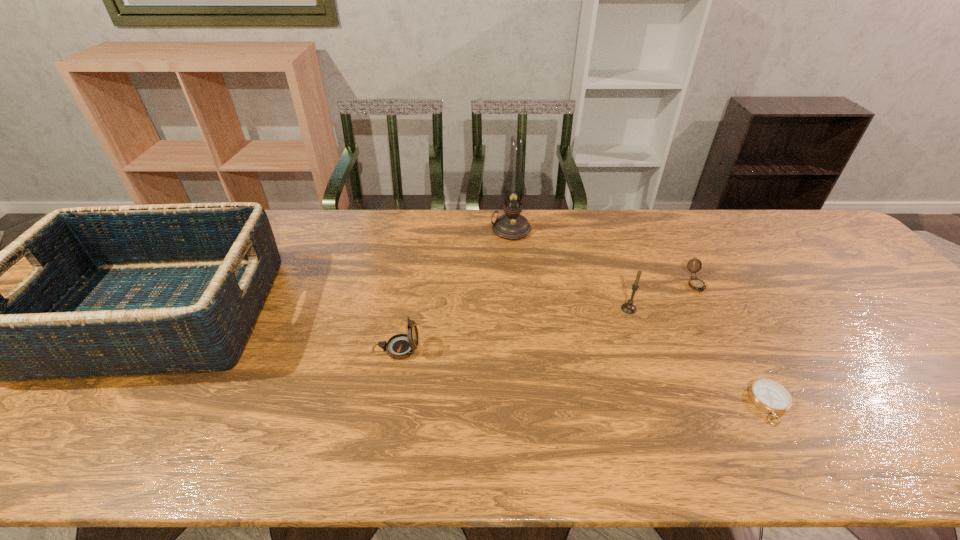
Select which compass appears as the second closest to the tallest compass. Please provide its 2D coordinates. Your answer should be formatted as a tuple, i.e. [(x, y)], where the tuple contains the x and y coordinates of a point satisfying the conditions above.

[(695, 283)]

Locate an element on the screen. This screenshot has width=960, height=540. free space that satisfies the following two spatial constraints: 1. on the face of the second shortest object; 2. on the right side of the shortest compass is located at coordinates (761, 404).